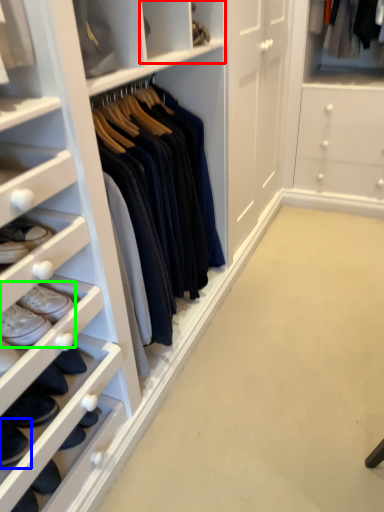
Question: Which object is the closest to the cabinet (highlighted by a red box)? Choose among these: footwear (highlighted by a blue box) or footwear (highlighted by a green box).

Choices:
 (A) footwear
 (B) footwear

Answer: (B)